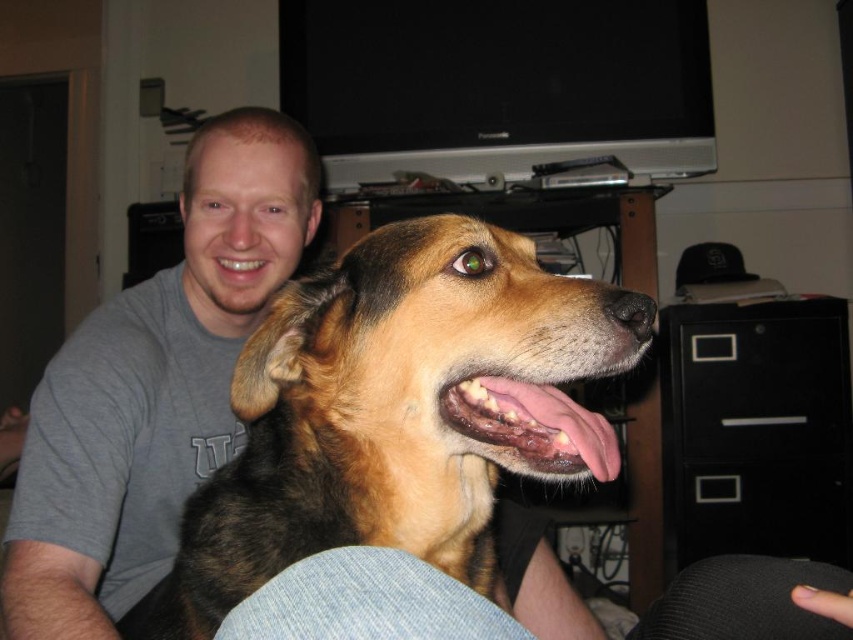
Question: Which point is closer to the camera?

Choices:
 (A) matte white teeth at center
 (B) gray cotton shirt at upper left
 (C) black plastic/file cabinet at right
 (D) brown fur dog at center

Answer: (D)

Question: Which of the following is the closest to the observer?

Choices:
 (A) brown fur dog at center
 (B) gray cotton shirt at upper left

Answer: (A)

Question: Is brown fur dog at center smaller than black plastic/file cabinet at right?

Choices:
 (A) no
 (B) yes

Answer: (A)

Question: Observing the image, what is the correct spatial positioning of brown fur dog at center in reference to pink flesh at center?

Choices:
 (A) above
 (B) below

Answer: (B)

Question: Is pink flesh at center positioned before matte white teeth at center?

Choices:
 (A) no
 (B) yes

Answer: (B)

Question: Which of the following is the farthest from the observer?

Choices:
 (A) (250, 250)
 (B) (117, 584)
 (C) (602, 426)
 (D) (816, 332)

Answer: (D)